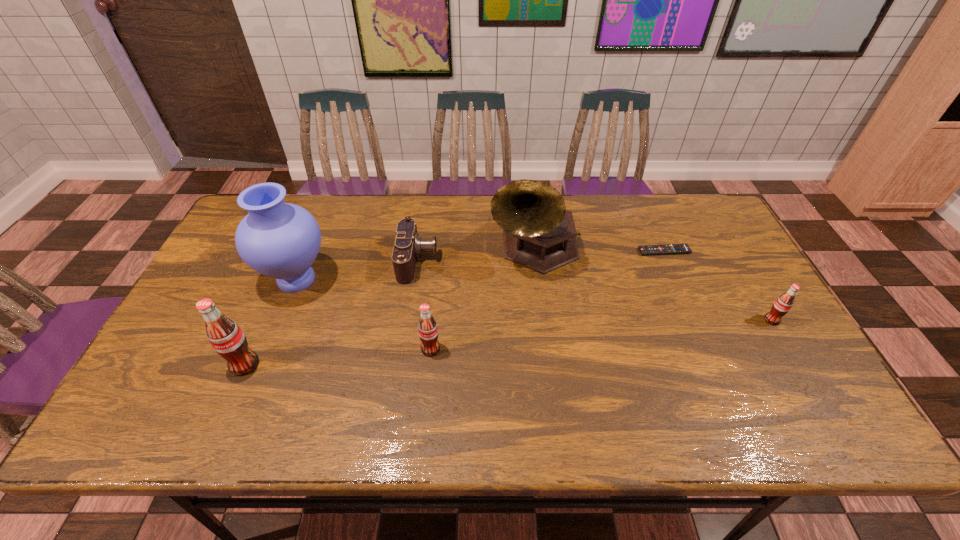
At what (x,y) coordinates should I click in order to perform the action: click on object that is at the near edge. Please return your answer as a coordinate pair (x, y). This screenshot has width=960, height=540. Looking at the image, I should click on (225, 336).

At what (x,y) coordinates should I click in order to perform the action: click on object present at the left edge. Please return your answer as a coordinate pair (x, y). Image resolution: width=960 pixels, height=540 pixels. Looking at the image, I should click on (280, 240).

Identify the location of soda located at the right edge. (782, 305).

Locate an element on the screen. remote control that is at the right edge is located at coordinates (667, 249).

The height and width of the screenshot is (540, 960). I want to click on blank space at the far edge of the desktop, so click(x=427, y=229).

Where is `free space at the near edge of the desktop`? The height and width of the screenshot is (540, 960). free space at the near edge of the desktop is located at coordinates (253, 381).

This screenshot has width=960, height=540. I want to click on free region at the left edge of the desktop, so click(200, 333).

In the image, there is a desktop. Identify the location of vacant space at the near left corner. The image size is (960, 540). (193, 376).

Find the location of a particular element. The image size is (960, 540). vacant space at the far right corner is located at coordinates (681, 233).

I want to click on vacant area that lies between the vase and the sixth object from left to right, so click(480, 265).